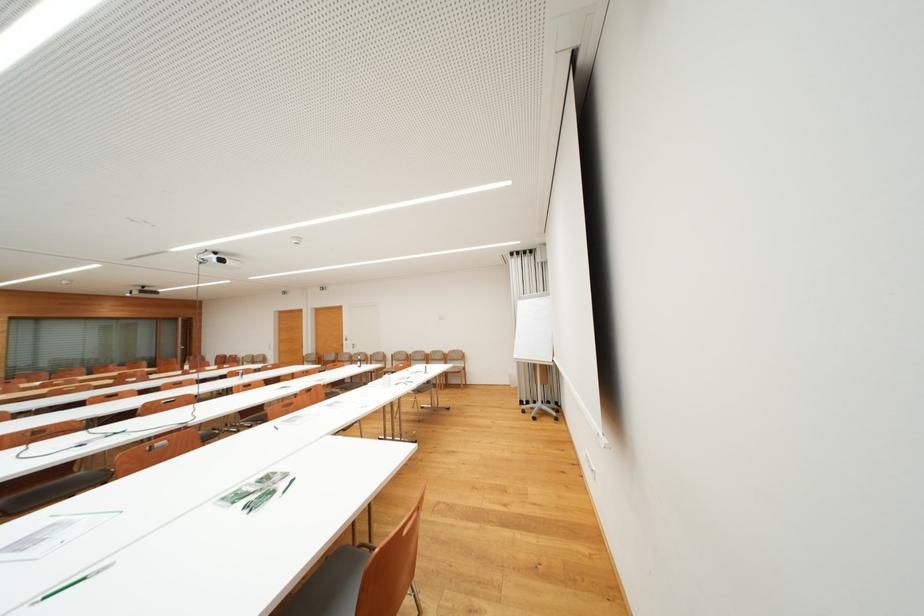
Where is `white door handle`? Image resolution: width=924 pixels, height=616 pixels. white door handle is located at coordinates (418, 408).